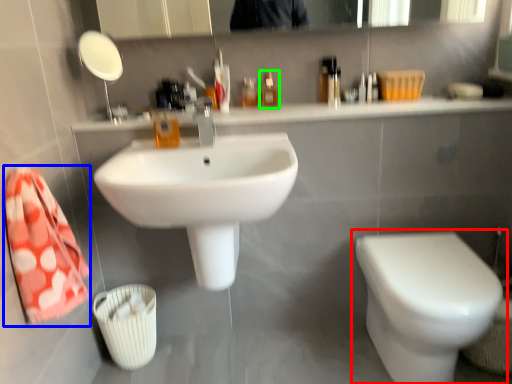
Question: Estimate the real-world distances between objects in this image. Which object is closer to toilet (highlighted by a red box), bath towel (highlighted by a blue box) or mouthwash (highlighted by a green box)?

Choices:
 (A) bath towel
 (B) mouthwash

Answer: (B)